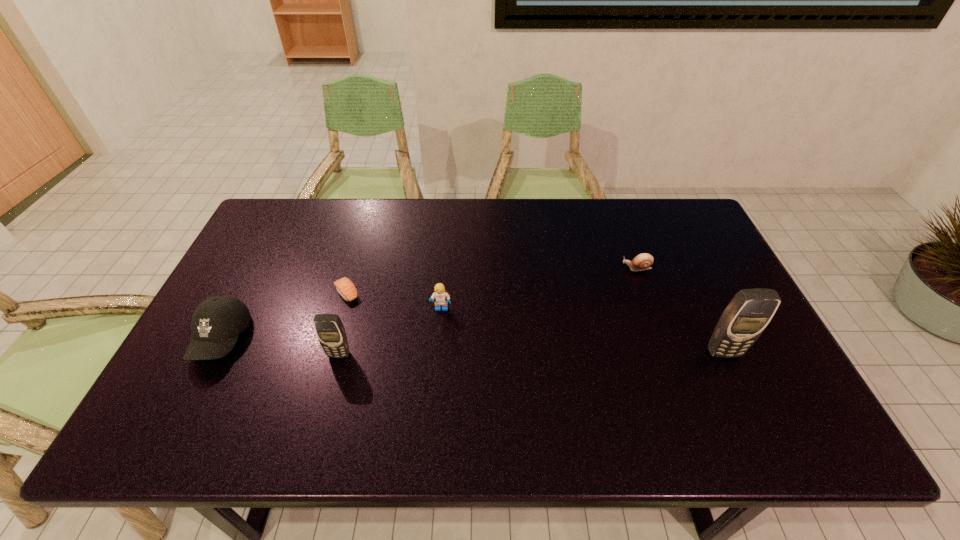
To make them evenly spaced by inserting another cellular_telephone among them, please locate a free space for this new cellular_telephone. Please provide its 2D coordinates. Your answer should be formatted as a tuple, i.e. [(x, y)], where the tuple contains the x and y coordinates of a point satisfying the conditions above.

[(532, 354)]